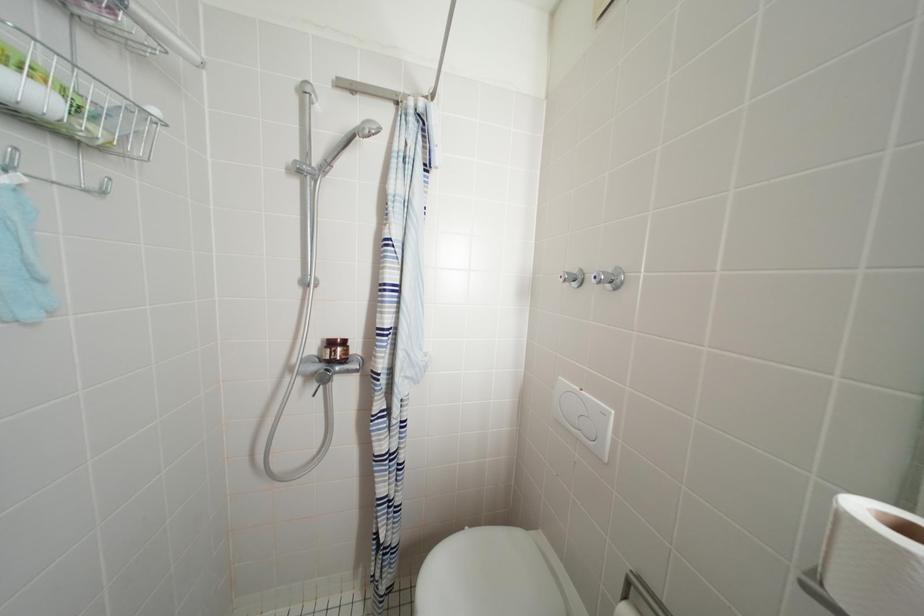
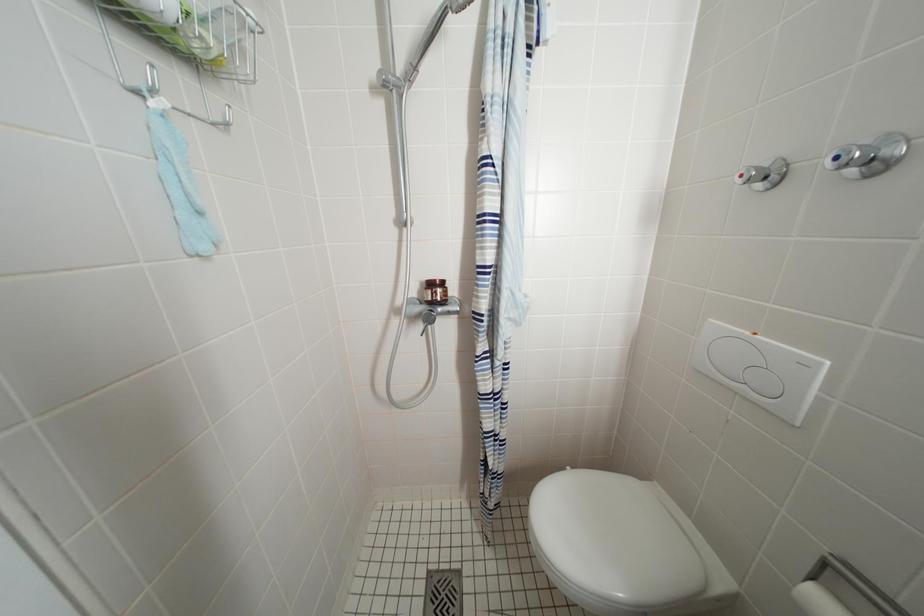
Question: The camera is either moving clockwise (left) or counter-clockwise (right) around the object. The first image is from the beginning of the video and the second image is from the end. Is the camera moving left or right when shooting the video?

Choices:
 (A) Left
 (B) Right

Answer: (B)